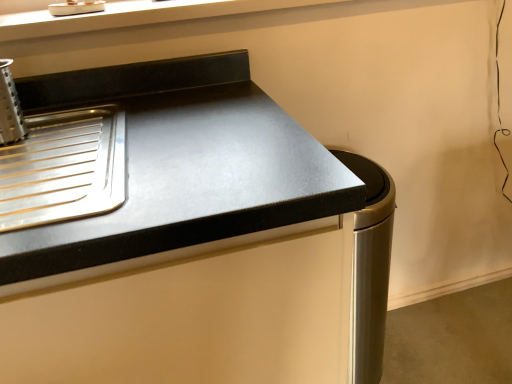
Question: Looking at the image, does black matte countertop at upper left seem bigger or smaller compared to satin silver trash can at lower right?

Choices:
 (A) big
 (B) small

Answer: (A)

Question: Which is correct: black matte countertop at upper left is inside satin silver trash can at lower right, or outside of it?

Choices:
 (A) outside
 (B) inside

Answer: (A)

Question: Is point (104, 233) positioned closer to the camera than point (360, 276)?

Choices:
 (A) closer
 (B) farther

Answer: (A)

Question: From their relative heights in the image, would you say satin silver trash can at lower right is taller or shorter than black matte countertop at upper left?

Choices:
 (A) short
 (B) tall

Answer: (A)

Question: From a real-world perspective, is satin silver trash can at lower right physically located above or below black matte countertop at upper left?

Choices:
 (A) below
 (B) above

Answer: (A)

Question: In the image, is satin silver trash can at lower right positioned in front of or behind black matte countertop at upper left?

Choices:
 (A) behind
 (B) front

Answer: (A)

Question: Considering the relative positions of satin silver trash can at lower right and black matte countertop at upper left in the image provided, is satin silver trash can at lower right to the left or to the right of black matte countertop at upper left?

Choices:
 (A) left
 (B) right

Answer: (B)